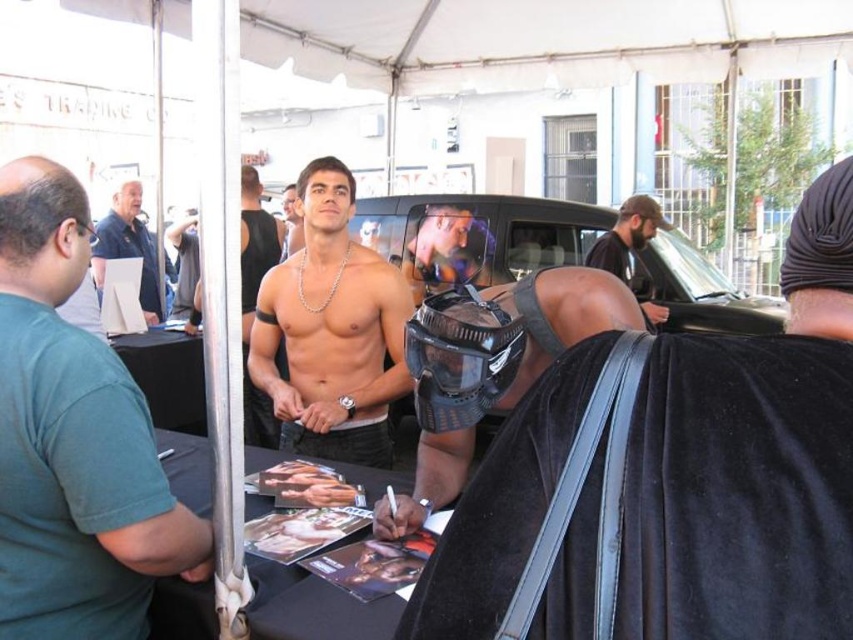
Does green t-shirt at left have a larger size compared to bearded man at center?

No, green t-shirt at left is not bigger than bearded man at center.

Measure the distance between point (80, 528) and camera.

Point (80, 528) and camera are 3.81 feet apart from each other.

What are the coordinates of `green t-shirt at left` in the screenshot? It's located at (73, 440).

Measure the distance between green t-shirt at left and camera.

green t-shirt at left and camera are 3.66 feet apart.

Is point (120, 404) more distant than point (399, 499)?

No.

Between point (30, 204) and point (537, 300), which one is positioned in front?

Point (30, 204)

This screenshot has height=640, width=853. In order to click on green t-shirt at left in this screenshot , I will do `click(73, 440)`.

Which of these two, shiny silver chain at center or smooth skin torso at center, stands taller?

Standing taller between the two is shiny silver chain at center.

Is shiny silver chain at center thinner than smooth skin torso at center?

Incorrect, shiny silver chain at center's width is not less than smooth skin torso at center's.

Between point (381, 352) and point (288, 211), which one is positioned in front?

Point (381, 352) is more forward.

Find the location of `shiny silver chain at center`. shiny silver chain at center is located at coordinates (331, 330).